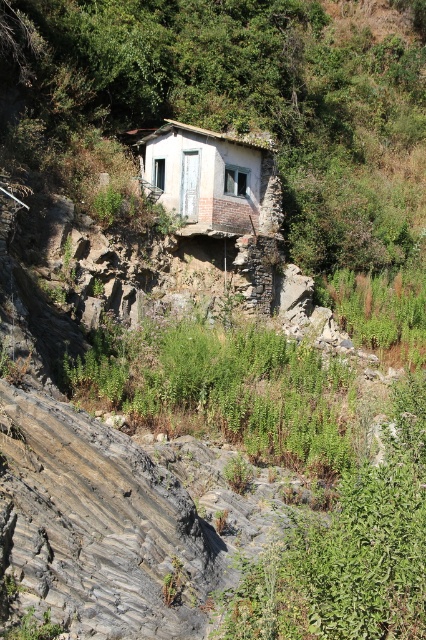
Question: Is green leafy plants at center to the left of white weathered hut at center from the viewer's perspective?

Choices:
 (A) yes
 (B) no

Answer: (B)

Question: Which of the following is the closest to the observer?

Choices:
 (A) white weathered hut at center
 (B) green leafy plants at center

Answer: (B)

Question: Does green leafy plants at center lie behind white weathered hut at center?

Choices:
 (A) no
 (B) yes

Answer: (A)

Question: Where is green leafy plants at center located in relation to white weathered hut at center in the image?

Choices:
 (A) below
 (B) above

Answer: (A)